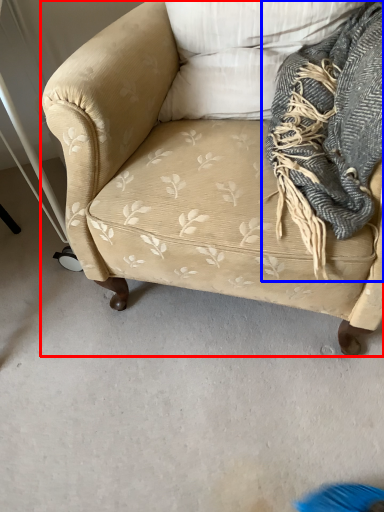
Question: Which object is closer to the camera taking this photo, studio couch (highlighted by a red box) or scarf (highlighted by a blue box)?

Choices:
 (A) studio couch
 (B) scarf

Answer: (A)